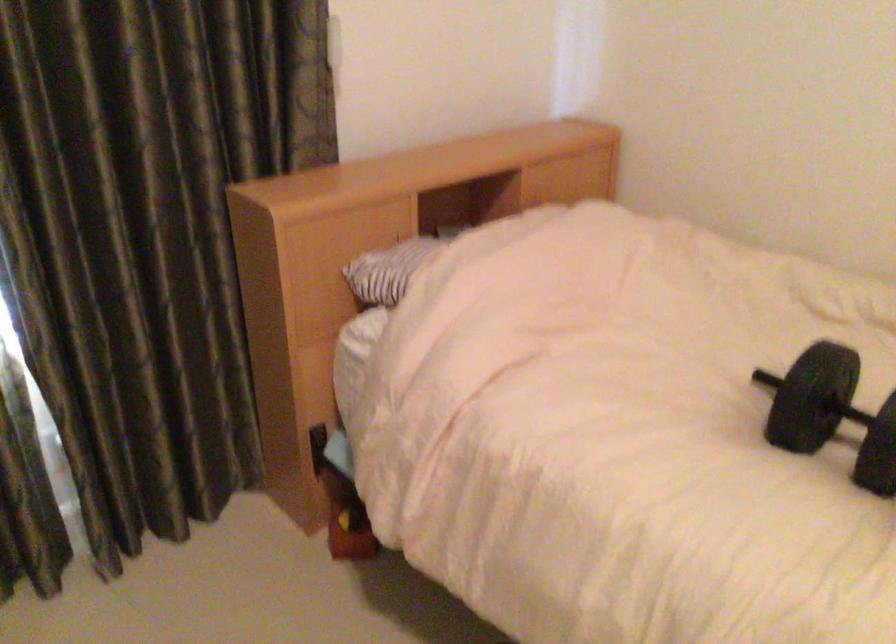
Where is `cabinet door handle`? cabinet door handle is located at coordinates (317, 447).